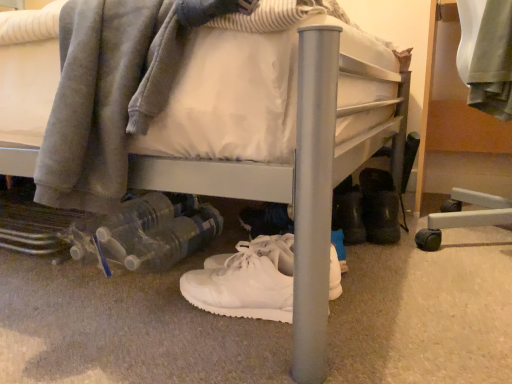
This screenshot has width=512, height=384. Identify the location of black rubber boots at lower right, the first footwear from the back. (379, 206).

Locate an element on the screen. brushed metal bed frame at right is located at coordinates (478, 83).

Image resolution: width=512 pixels, height=384 pixels. What do you see at coordinates (246, 281) in the screenshot? I see `white leather sneakers at center, the 2th footwear viewed from the top` at bounding box center [246, 281].

Find the location of a particular element. The width and height of the screenshot is (512, 384). black rubber boots at lower right, the second footwear positioned from the left is located at coordinates (379, 206).

Which is nearer, (490, 1) or (393, 225)?

Clearly, point (490, 1) is closer to the camera than point (393, 225).

Looking at the image, does brushed metal bed frame at right seem bigger or smaller compared to black rubber boots at lower right, marked as the 2th footwear in a bottom-to-top arrangement?

In the image, brushed metal bed frame at right appears to be larger than black rubber boots at lower right, marked as the 2th footwear in a bottom-to-top arrangement.

From the image's perspective, between brushed metal bed frame at right and black rubber boots at lower right, the first footwear from the back, who is located below?

black rubber boots at lower right, the first footwear from the back, appears lower in the image.

From the image's perspective, is white leather sneakers at center, the second footwear from the back, positioned above or below black rubber boots at lower right, marked as the 2th footwear in a bottom-to-top arrangement?

Clearly, from the image's perspective, white leather sneakers at center, the second footwear from the back, is below black rubber boots at lower right, marked as the 2th footwear in a bottom-to-top arrangement.

Is white leather sneakers at center, which ranks as the 1th footwear in front-to-back order, with black rubber boots at lower right, the first footwear from the back?

They are not placed beside each other.

Considering the relative positions of white leather sneakers at center, positioned as the first footwear in left-to-right order, and black rubber boots at lower right, marked as the 2th footwear in a bottom-to-top arrangement, in the image provided, is white leather sneakers at center, positioned as the first footwear in left-to-right order, to the right of black rubber boots at lower right, marked as the 2th footwear in a bottom-to-top arrangement, from the viewer's perspective?

In fact, white leather sneakers at center, positioned as the first footwear in left-to-right order, is to the left of black rubber boots at lower right, marked as the 2th footwear in a bottom-to-top arrangement.

Is white leather sneakers at center, the second footwear from the back, oriented towards black rubber boots at lower right, the first footwear from the back?

No, white leather sneakers at center, the second footwear from the back, is not turned towards black rubber boots at lower right, the first footwear from the back.

Is white leather sneakers at center, the 2th footwear when ordered from right to left, beside brushed metal bed frame at right?

There is a gap between white leather sneakers at center, the 2th footwear when ordered from right to left, and brushed metal bed frame at right.

In the image, is white leather sneakers at center, which ranks as the 1th footwear in front-to-back order, positioned in front of or behind brushed metal bed frame at right?

Clearly, white leather sneakers at center, which ranks as the 1th footwear in front-to-back order, is in front of brushed metal bed frame at right.

From a real-world perspective, is white leather sneakers at center, the 2th footwear viewed from the top, under brushed metal bed frame at right?

Yes.

Between white leather sneakers at center, positioned as the first footwear in left-to-right order, and brushed metal bed frame at right, which one has larger size?

brushed metal bed frame at right.

Is brushed metal bed frame at right spatially inside white leather sneakers at center, the 2th footwear when ordered from right to left, or outside of it?

The correct answer is: outside.

From the image's perspective, is brushed metal bed frame at right under white leather sneakers at center, the first footwear in the bottom-to-top sequence?

Incorrect, from the image's perspective, brushed metal bed frame at right is higher than white leather sneakers at center, the first footwear in the bottom-to-top sequence.

Considering the positions of point (479, 111) and point (252, 314), is point (479, 111) closer or farther from the camera than point (252, 314)?

Point (479, 111).

Is brushed metal bed frame at right shorter than white leather sneakers at center, the first footwear in the bottom-to-top sequence?

No, brushed metal bed frame at right is not shorter than white leather sneakers at center, the first footwear in the bottom-to-top sequence.

From a real-world perspective, is black rubber boots at lower right, marked as the 2th footwear in a bottom-to-top arrangement, below white leather sneakers at center, the 2th footwear when ordered from right to left?

No, from a real-world perspective, black rubber boots at lower right, marked as the 2th footwear in a bottom-to-top arrangement, is not under white leather sneakers at center, the 2th footwear when ordered from right to left.

Does point (377, 207) come closer to viewer compared to point (211, 303)?

No, (377, 207) is behind (211, 303).

Which object is further away from the camera, black rubber boots at lower right, marked as the 2th footwear in a bottom-to-top arrangement, or white leather sneakers at center, positioned as the first footwear in left-to-right order?

black rubber boots at lower right, marked as the 2th footwear in a bottom-to-top arrangement, is more distant.

Between black rubber boots at lower right, the second footwear positioned from the left, and white leather sneakers at center, the 2th footwear viewed from the top, which one has larger size?

black rubber boots at lower right, the second footwear positioned from the left.

From a real-world perspective, is black rubber boots at lower right, marked as the 2th footwear in a bottom-to-top arrangement, positioned over brushed metal bed frame at right based on gravity?

Actually, black rubber boots at lower right, marked as the 2th footwear in a bottom-to-top arrangement, is physically below brushed metal bed frame at right in the real world.

From the image's perspective, between black rubber boots at lower right, the first footwear from the back, and brushed metal bed frame at right, which one is located above?

From the image's view, brushed metal bed frame at right is above.

How much distance is there between black rubber boots at lower right, the first footwear from the back, and brushed metal bed frame at right?

black rubber boots at lower right, the first footwear from the back, is 10.00 inches from brushed metal bed frame at right.

Is black rubber boots at lower right, the 1th footwear from the right, positioned beyond the bounds of brushed metal bed frame at right?

Absolutely, black rubber boots at lower right, the 1th footwear from the right, is external to brushed metal bed frame at right.

What are the coordinates of `furniture located above the black rubber boots at lower right, marked as the 2th footwear in a bottom-to-top arrangement (from the image's perspective)` in the screenshot? It's located at (478, 83).

You are a GUI agent. You are given a task and a screenshot of the screen. Output one action in this format:
    pyautogui.click(x=<x>, y=<y>)
    Task: Click on the footwear that is under the black rubber boots at lower right, marked as the 2th footwear in a bottom-to-top arrangement (from a real-world perspective)
    The image size is (512, 384).
    Given the screenshot: What is the action you would take?
    pyautogui.click(x=246, y=281)

Estimate the real-world distances between objects in this image. Which object is closer to brushed metal bed frame at right, white leather sneakers at center, the 2th footwear when ordered from right to left, or black rubber boots at lower right, the second footwear positioned from the left?

black rubber boots at lower right, the second footwear positioned from the left.

Considering their positions, is white leather sneakers at center, positioned as the first footwear in left-to-right order, positioned closer to black rubber boots at lower right, marked as the 2th footwear in a bottom-to-top arrangement, than brushed metal bed frame at right?

brushed metal bed frame at right is closer to black rubber boots at lower right, marked as the 2th footwear in a bottom-to-top arrangement.

When comparing their distances from black rubber boots at lower right, marked as the 2th footwear in a bottom-to-top arrangement, does brushed metal bed frame at right or white leather sneakers at center, the second footwear from the back, seem closer?

brushed metal bed frame at right is closer to black rubber boots at lower right, marked as the 2th footwear in a bottom-to-top arrangement.

Looking at the image, which one is located closer to white leather sneakers at center, the 2th footwear when ordered from right to left, black rubber boots at lower right, marked as the 2th footwear in a bottom-to-top arrangement, or brushed metal bed frame at right?

Based on the image, black rubber boots at lower right, marked as the 2th footwear in a bottom-to-top arrangement, appears to be nearer to white leather sneakers at center, the 2th footwear when ordered from right to left.

Based on their spatial positions, is brushed metal bed frame at right or black rubber boots at lower right, the 1th footwear from the right, further from white leather sneakers at center, positioned as the first footwear in left-to-right order?

brushed metal bed frame at right is positioned further to the anchor white leather sneakers at center, positioned as the first footwear in left-to-right order.

Which object lies nearer to the anchor point brushed metal bed frame at right, black rubber boots at lower right, positioned as the 2th footwear in front-to-back order, or white leather sneakers at center, the second footwear from the back?

black rubber boots at lower right, positioned as the 2th footwear in front-to-back order, lies closer to brushed metal bed frame at right than the other object.

You are a GUI agent. You are given a task and a screenshot of the screen. Output one action in this format:
    pyautogui.click(x=<x>, y=<y>)
    Task: Click on the footwear between white leather sneakers at center, which ranks as the 1th footwear in front-to-back order, and brushed metal bed frame at right from left to right
    This screenshot has height=384, width=512.
    Given the screenshot: What is the action you would take?
    pyautogui.click(x=379, y=206)